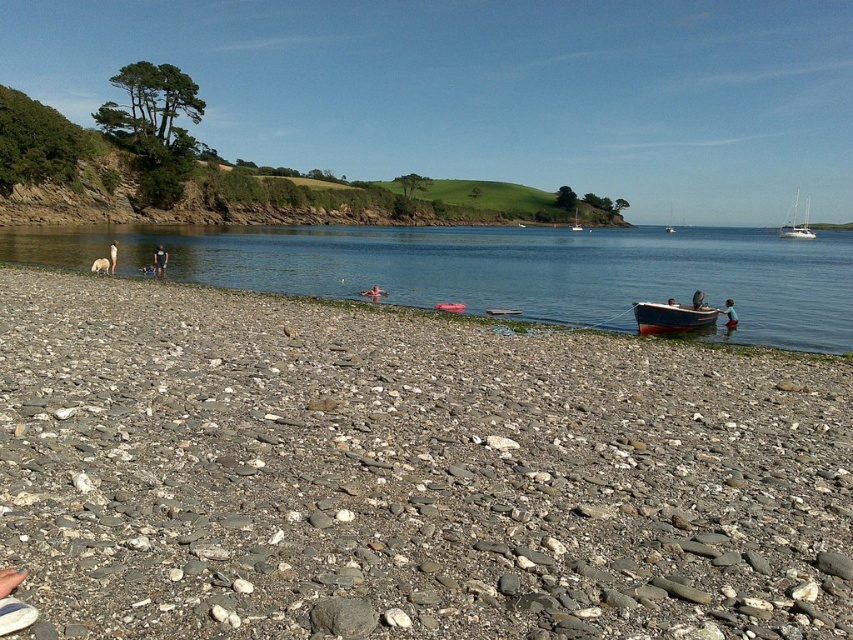
You are a lifeguard standing on a tower that has a 50 meter visibility range. You see the clear water at beach left and the smooth skin person at center. Can you see both of them from your position?

The clear water at beach left and smooth skin person at center are 46.15 meters apart from each other. Since the visibility range is 50 meters, both objects are within the range, so yes, you can see both the clear water at beach left and the smooth skin person at center.

You are standing on the pebble beach and want to walk to the water. Which object, the clear water at beach left or the smooth skin person at center, is wider from your perspective?

The clear water at beach left is wider than the smooth skin person at center from your perspective.

You are a photographer planning to capture a landscape shot of the coastal scene. You want to ensure that both the blue wooden boat at lower right and the white glossy sailboat at upper right are visible in the frame. Considering their positions and sizes, which boat should you focus on to ensure both are in the frame without cropping?

The blue wooden boat at lower right has a lesser height compared to the white glossy sailboat at upper right. To ensure both are in the frame without cropping, focus on the taller white glossy sailboat at upper right as it occupies more vertical space, allowing the smaller blue wooden boat at lower right to fit naturally within the composition.